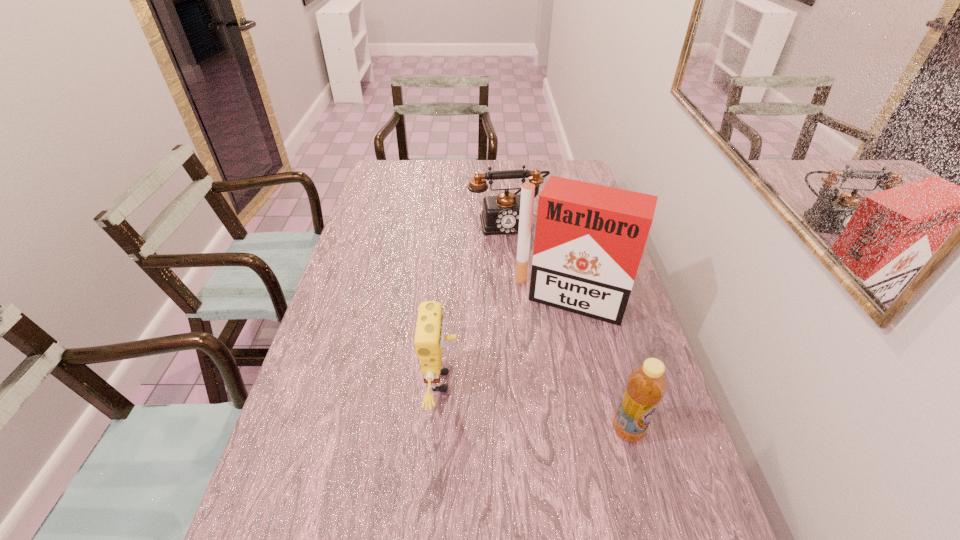
The width and height of the screenshot is (960, 540). I want to click on the leftmost object, so click(x=429, y=339).

You are a GUI agent. You are given a task and a screenshot of the screen. Output one action in this format:
    pyautogui.click(x=<x>, y=<y>)
    Task: Click on the bottle
    Image resolution: width=960 pixels, height=540 pixels.
    Given the screenshot: What is the action you would take?
    pyautogui.click(x=646, y=385)

In order to click on telephone in this screenshot , I will do `click(500, 215)`.

I want to click on cigarette case, so click(x=589, y=239).

The height and width of the screenshot is (540, 960). I want to click on the second farthest object, so click(x=589, y=239).

Find the location of a particular element. vacant point located 0.350m on the face of the leftmost object is located at coordinates (599, 382).

The image size is (960, 540). In order to click on free space located on the left of the bottle in this screenshot , I will do `click(524, 430)`.

Identify the location of free space located on the front of the farthest object at the rotary dial. The height and width of the screenshot is (540, 960). (522, 272).

Locate an element on the screen. vacant space situated 0.360m on the front of the farthest object at the rotary dial is located at coordinates (533, 310).

Locate an element on the screen. The width and height of the screenshot is (960, 540). vacant space located on the front of the farthest object at the rotary dial is located at coordinates click(525, 282).